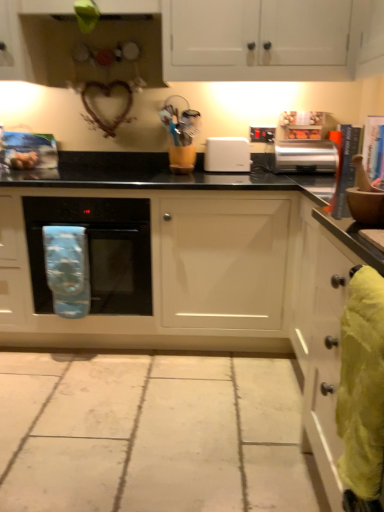
Question: Visually, is yellow fabric towel at right, marked as the 1th material in a right-to-left arrangement, positioned to the left or to the right of satin silver toaster at upper right?

Choices:
 (A) right
 (B) left

Answer: (B)

Question: In terms of size, does yellow fabric towel at right, the 1th material positioned from the front, appear bigger or smaller than satin silver toaster at upper right?

Choices:
 (A) big
 (B) small

Answer: (B)

Question: Which is farther from the white glossy cabinet at right, which appears as the third cabinetry when viewed from the top?

Choices:
 (A) black glass microwave at center
 (B) satin silver toaster at upper right
 (C) white matte cabinet at center, acting as the second cabinetry starting from the top
 (D) blue fabric oven mitt at left, which is counted as the second material, starting from the front
 (E) yellow fabric towel at right, marked as the 1th material in a right-to-left arrangement

Answer: (D)

Question: Which object is the farthest from the blue fabric oven mitt at left, which ranks as the 2th material in right-to-left order?

Choices:
 (A) white plastic toaster at center
 (B) satin silver toaster at upper right
 (C) white matte cabinet at upper center, the first cabinetry from the top
 (D) white matte cabinet at center, acting as the second cabinetry starting from the top
 (E) white glossy cabinet at right, the first cabinetry in the bottom-to-top sequence

Answer: (B)